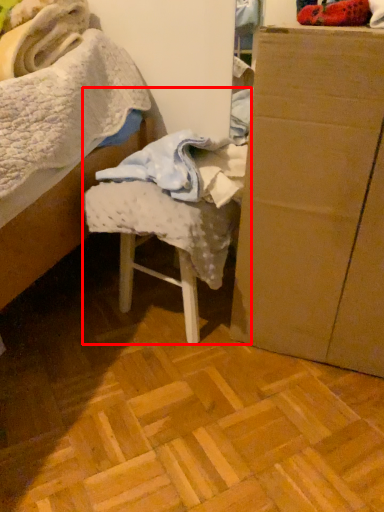
Question: From the image's perspective, where is chair (annotated by the red box) located relative to furniture?

Choices:
 (A) above
 (B) below

Answer: (B)